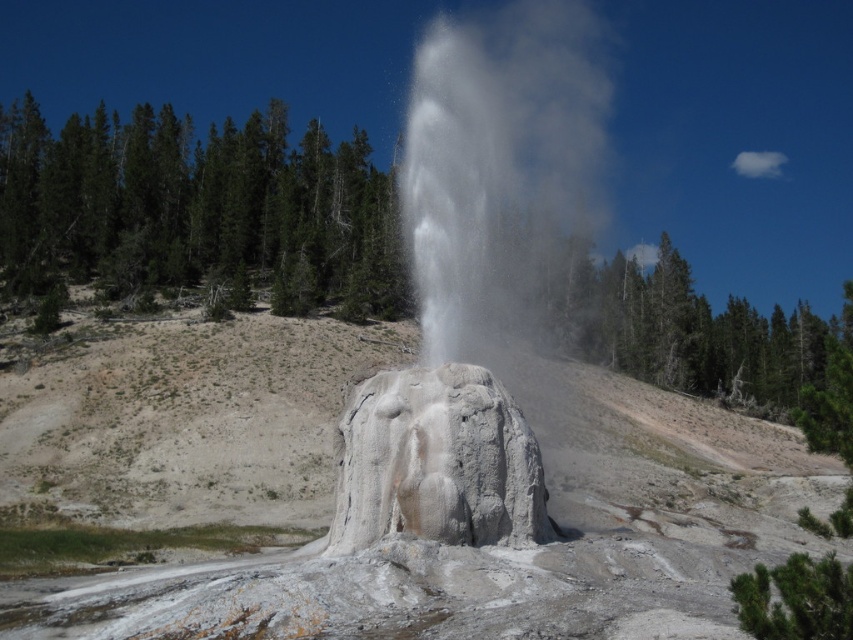
You are standing at the base of the erupting geyser and want to place two markers at point (503, 417) and point (433, 518). Which marker will be closer to you when viewed from your current position?

Point (503, 417) is closer to you because it is further to the viewer than point (433, 518).

You are standing in the natural setting of the geyser. You see the white stone geyser at center and the white textured rock at center. Which object is located to the right of the other?

The white stone geyser at center is positioned on the right side of white textured rock at center, so the white stone geyser at center is to the right of the white textured rock at center.